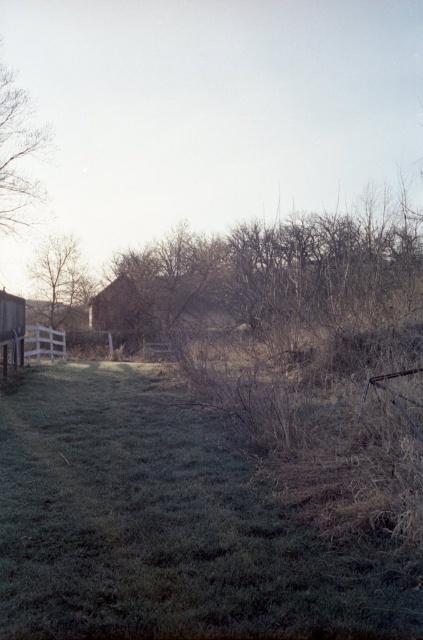
Does green grass at center have a lesser width compared to smooth brown tree at left?

No.

Which is below, green grass at center or smooth brown tree at left?

green grass at center

The image size is (423, 640). In order to click on green grass at center in this screenshot , I will do `click(164, 522)`.

At what (x,y) coordinates should I click in order to perform the action: click on green grass at center. Please return your answer as a coordinate pair (x, y). Looking at the image, I should click on (164, 522).